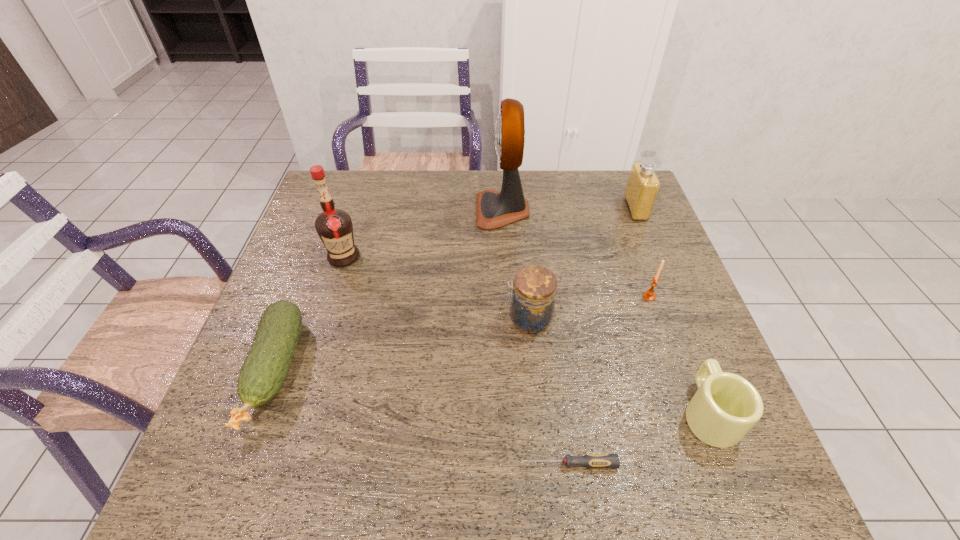
At what (x,y) coordinates should I click in order to perform the action: click on the tallest object. Please return your answer as a coordinate pair (x, y). This screenshot has width=960, height=540. Looking at the image, I should click on (494, 209).

At what (x,y) coordinates should I click in order to perform the action: click on liquor. Please return your answer as a coordinate pair (x, y). The height and width of the screenshot is (540, 960). Looking at the image, I should click on (334, 226).

The height and width of the screenshot is (540, 960). Identify the location of the sixth nearest object. (334, 226).

Where is `the third tallest object`? Image resolution: width=960 pixels, height=540 pixels. the third tallest object is located at coordinates (643, 185).

Where is `jar`? Image resolution: width=960 pixels, height=540 pixels. jar is located at coordinates (533, 293).

Identify the location of the fifth nearest object. The width and height of the screenshot is (960, 540). (649, 295).

The width and height of the screenshot is (960, 540). Identify the location of mug. pos(726,406).

Image resolution: width=960 pixels, height=540 pixels. Identify the location of cucumber. (263, 373).

Find the location of `the nearest object`. the nearest object is located at coordinates (594, 461).

The image size is (960, 540). Identify the location of screwdriver. (594, 461).